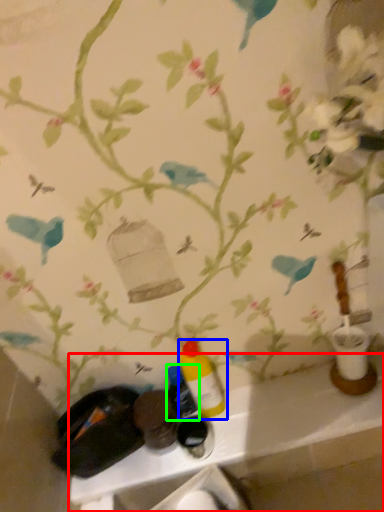
Question: Estimate the real-world distances between objects in this image. Which object is closer to counter (highlighted by a red box), bottle (highlighted by a blue box) or bottle (highlighted by a green box)?

Choices:
 (A) bottle
 (B) bottle

Answer: (A)